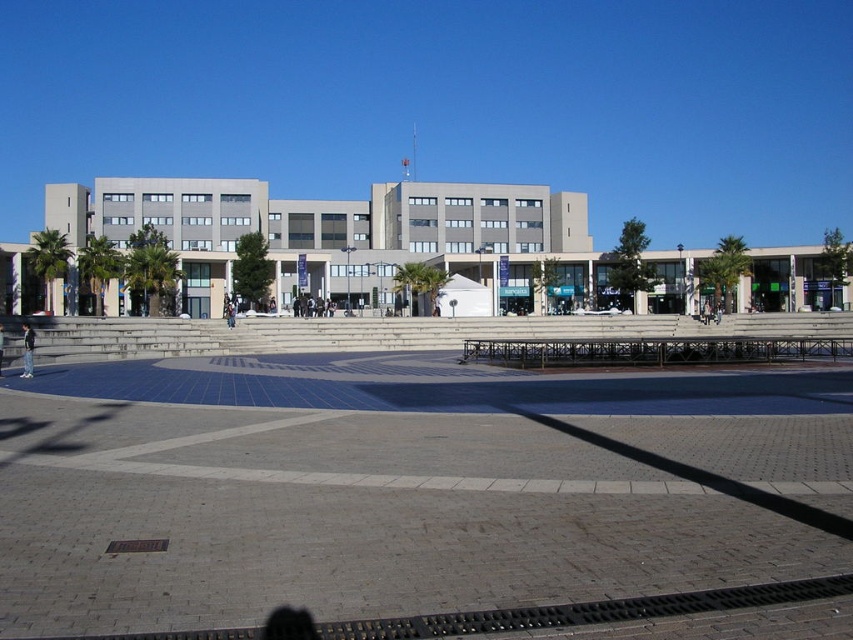
Can you confirm if concrete steps at center is thinner than brick pavement at lower center?

Incorrect, concrete steps at center's width is not less than brick pavement at lower center's.

Is point (482, 442) farther from viewer compared to point (109, 547)?

Yes.

Find the location of a particular element. The image size is (853, 640). concrete steps at center is located at coordinates (401, 468).